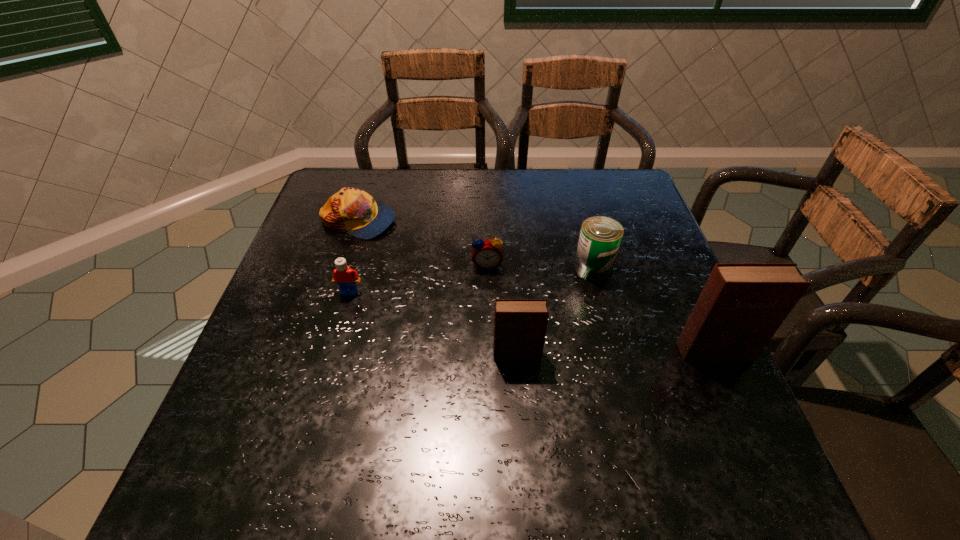
Find the location of a particular element. This screenshot has width=960, height=540. object present at the far left corner is located at coordinates (354, 211).

Locate an element on the screen. This screenshot has height=540, width=960. blank area at the far edge is located at coordinates (525, 177).

At what (x,y) coordinates should I click in order to perform the action: click on blank space at the near edge. Please return your answer as a coordinate pair (x, y). Looking at the image, I should click on (x=361, y=431).

The height and width of the screenshot is (540, 960). I want to click on free space at the left edge, so click(344, 234).

Image resolution: width=960 pixels, height=540 pixels. In the image, there is a desktop. What are the coordinates of `free space at the right edge` in the screenshot? It's located at (649, 264).

At what (x,y) coordinates should I click in order to perform the action: click on free region at the far left corner of the desktop. Please return your answer as a coordinate pair (x, y). The width and height of the screenshot is (960, 540). Looking at the image, I should click on (331, 191).

The height and width of the screenshot is (540, 960). In the image, there is a desktop. Identify the location of vacant space at the far right corner. (593, 179).

In the image, there is a desktop. Where is `free space at the near right corner`? The width and height of the screenshot is (960, 540). free space at the near right corner is located at coordinates (675, 427).

At what (x,y) coordinates should I click in order to perform the action: click on unoccupied position between the can and the Lego. Please return your answer as a coordinate pair (x, y). The width and height of the screenshot is (960, 540). Looking at the image, I should click on (471, 280).

The height and width of the screenshot is (540, 960). Identify the location of vacant area that lies between the Lego and the cap. (353, 256).